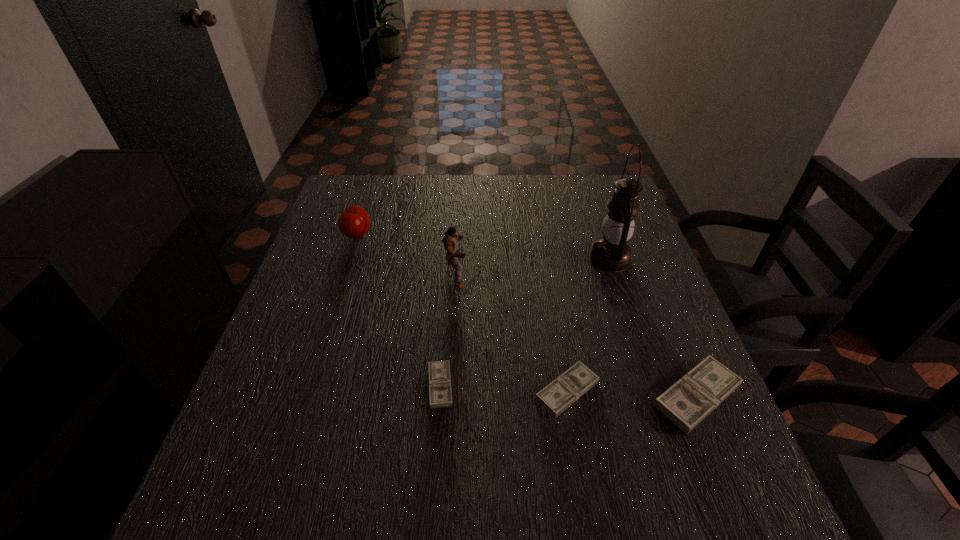
The height and width of the screenshot is (540, 960). Identify the location of empty space that is in between the shortest money and the fifth shortest object. (448, 330).

Where is `empty location between the oil lamp and the fourth object from left to right`? Image resolution: width=960 pixels, height=540 pixels. empty location between the oil lamp and the fourth object from left to right is located at coordinates (588, 325).

Identify the location of empty location between the shortest money and the second tallest object. (448, 330).

Where is `blank region between the apple and the rightmost money`? This screenshot has width=960, height=540. blank region between the apple and the rightmost money is located at coordinates (527, 315).

Locate an element on the screen. The height and width of the screenshot is (540, 960). vacant area that lies between the leftmost money and the oil lamp is located at coordinates pyautogui.click(x=525, y=322).

Locate an element on the screen. This screenshot has height=540, width=960. unoccupied area between the apple and the fifth shortest object is located at coordinates (407, 255).

Locate an element on the screen. object identified as the closest to the shortest money is located at coordinates (557, 396).

Where is `object that is the closest to the fourth object from left to right`? The width and height of the screenshot is (960, 540). object that is the closest to the fourth object from left to right is located at coordinates (692, 398).

Identify which money is located as the second nearest to the tallest object. Please provide its 2D coordinates. Your answer should be formatted as a tuple, i.e. [(x, y)], where the tuple contains the x and y coordinates of a point satisfying the conditions above.

[(557, 396)]

Identify the location of money that is the nearest to the leftmost money. (557, 396).